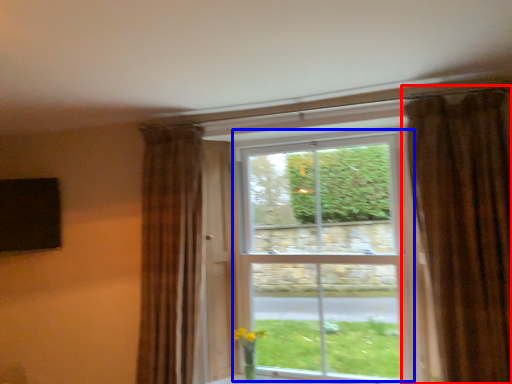
Question: Which object appears farthest to the camera in this image, curtain (highlighted by a red box) or bay window (highlighted by a blue box)?

Choices:
 (A) curtain
 (B) bay window

Answer: (B)